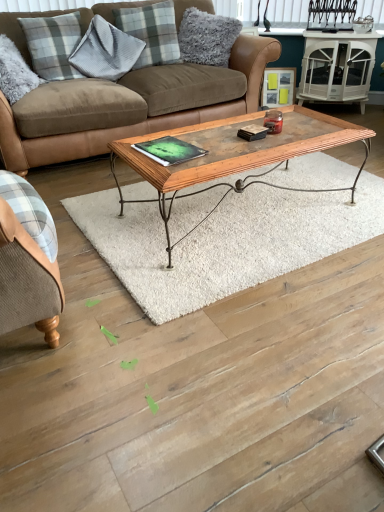
Question: From a real-world perspective, is fluffy gray pillow at upper center, marked as the 1th pillow in a right-to-left arrangement, above or below white glossy side table at upper right?

Choices:
 (A) above
 (B) below

Answer: (A)

Question: Based on their positions, is fluffy gray pillow at upper center, marked as the 1th pillow in a right-to-left arrangement, located to the left or right of white glossy side table at upper right?

Choices:
 (A) right
 (B) left

Answer: (B)

Question: Which of these objects is positioned farthest from the gray plaid pillow at upper left, which appears as the 2th pillow when viewed from the right?

Choices:
 (A) green matte book at center
 (B) matte wooden picture frame at upper right
 (C) wooden glass top coffee table at center
 (D) plaid fabric pillow at upper left, arranged as the second pillow when viewed from the left
 (E) brown leather couch at center

Answer: (A)

Question: Which object is positioned closest to the plaid fabric pillow at upper left, which is the 3th pillow in right-to-left order?

Choices:
 (A) matte wooden picture frame at upper right
 (B) fluffy gray pillow at upper center, marked as the 1th pillow in a right-to-left arrangement
 (C) wooden table at center
 (D) white glossy side table at upper right
 (E) wooden glass top coffee table at center

Answer: (B)